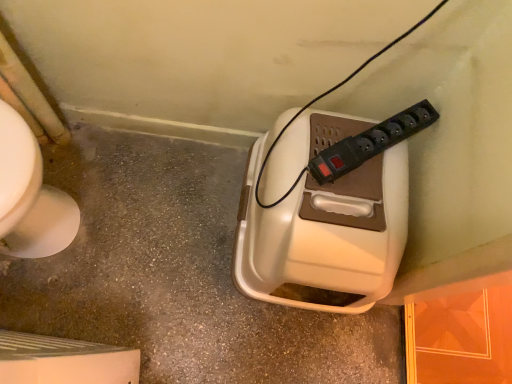
Question: Considering the positions of beige plastic container at center and black plastic power plugs and sockets at upper center in the image, is beige plastic container at center taller or shorter than black plastic power plugs and sockets at upper center?

Choices:
 (A) tall
 (B) short

Answer: (B)

Question: Is beige plastic container at center in front of or behind black plastic power plugs and sockets at upper center in the image?

Choices:
 (A) front
 (B) behind

Answer: (B)

Question: Which of these objects is positioned closest to the white plastic hand dryer at center?

Choices:
 (A) beige plastic container at center
 (B) black plastic power plugs and sockets at upper center

Answer: (B)

Question: Which object is the farthest from the beige plastic container at center?

Choices:
 (A) white plastic hand dryer at center
 (B) black plastic power plugs and sockets at upper center

Answer: (B)